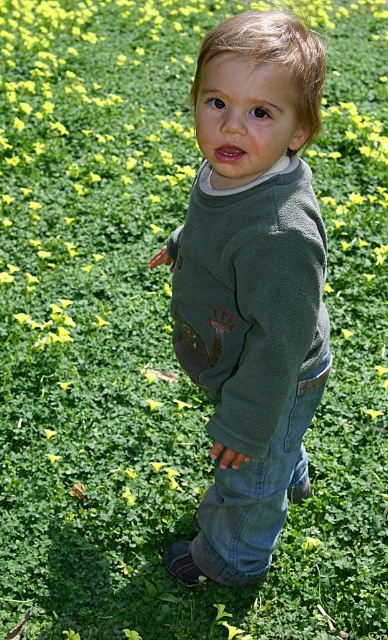
Question: Which of the following is the farthest from the observer?

Choices:
 (A) (244, 579)
 (B) (263, 484)

Answer: (A)

Question: Is green matte sweater at center in front of jeans at lower center?

Choices:
 (A) yes
 (B) no

Answer: (A)

Question: Among these points, which one is farthest from the camera?

Choices:
 (A) (275, 472)
 (B) (249, 49)

Answer: (A)

Question: Which object appears closest to the camera in this image?

Choices:
 (A) jeans at lower center
 (B) green matte sweater at center

Answer: (B)

Question: Can you confirm if green matte sweater at center is positioned to the right of jeans at lower center?

Choices:
 (A) yes
 (B) no

Answer: (B)

Question: Can you confirm if green matte sweater at center is wider than jeans at lower center?

Choices:
 (A) yes
 (B) no

Answer: (A)